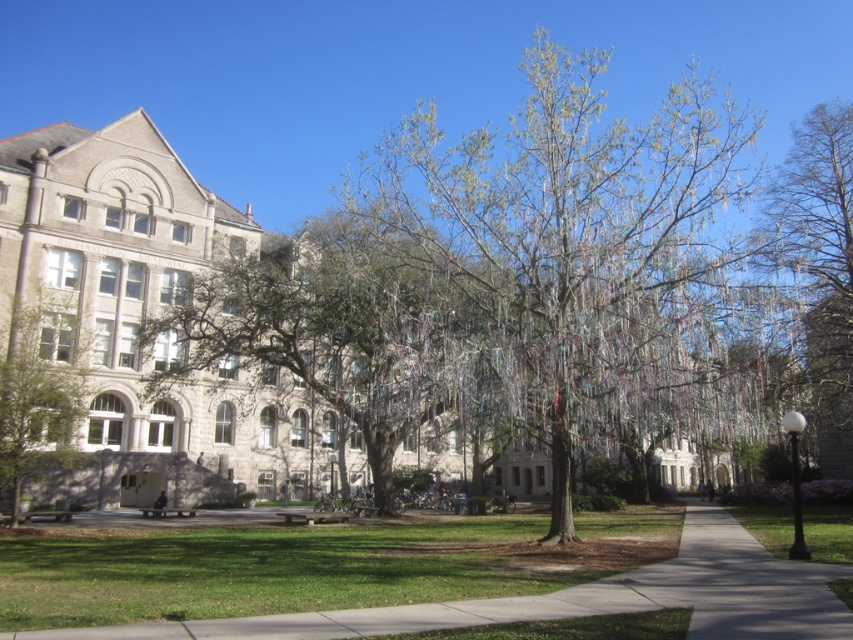
Question: Observing the image, what is the correct spatial positioning of green leafy tree at center in reference to smooth bark tree at right?

Choices:
 (A) below
 (B) above

Answer: (B)

Question: Observing the image, what is the correct spatial positioning of green grass at center in reference to smooth bark tree at right?

Choices:
 (A) right
 (B) left

Answer: (B)

Question: Does green leafy tree at center appear on the right side of smooth bark tree at right?

Choices:
 (A) no
 (B) yes

Answer: (A)

Question: Which of the following is the closest to the observer?

Choices:
 (A) green leafy tree at center
 (B) smooth bark tree at right
 (C) green leafy tree at left
 (D) green grass at center

Answer: (D)

Question: Among these objects, which one is farthest from the camera?

Choices:
 (A) green leafy tree at left
 (B) smooth bark tree at right
 (C) green leafy tree at center
 (D) green grass at center

Answer: (B)

Question: Which is nearer to the smooth bark tree at right?

Choices:
 (A) green grass at center
 (B) green leafy tree at left
 (C) green leafy tree at center

Answer: (C)